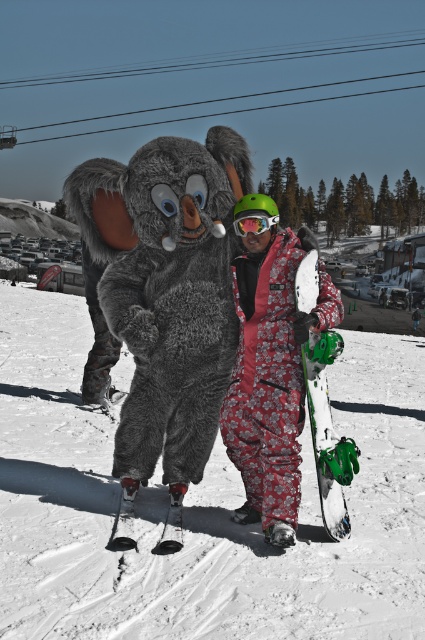
Question: Which object is farther from the camera taking this photo?

Choices:
 (A) fuzzy gray costume at center
 (B) white snowboard at center

Answer: (A)

Question: Can you confirm if fuzzy gray costume at center is wider than white matte snowboard at center?

Choices:
 (A) no
 (B) yes

Answer: (B)

Question: Is black matte ski at lower center further to the viewer compared to green matte goggles at center?

Choices:
 (A) no
 (B) yes

Answer: (A)

Question: Which object appears farthest from the camera in this image?

Choices:
 (A) floral snowsuit at center
 (B) black matte ski at lower center
 (C) fuzzy gray costume at center
 (D) white matte snowboard at center

Answer: (C)

Question: Can you confirm if white matte snowboard at center is bigger than green matte goggles at center?

Choices:
 (A) yes
 (B) no

Answer: (A)

Question: Which point is closer to the camera?

Choices:
 (A) green matte goggles at center
 (B) black matte ski at lower center
 (C) floral snowsuit at center
 (D) fuzzy gray costume at center

Answer: (B)